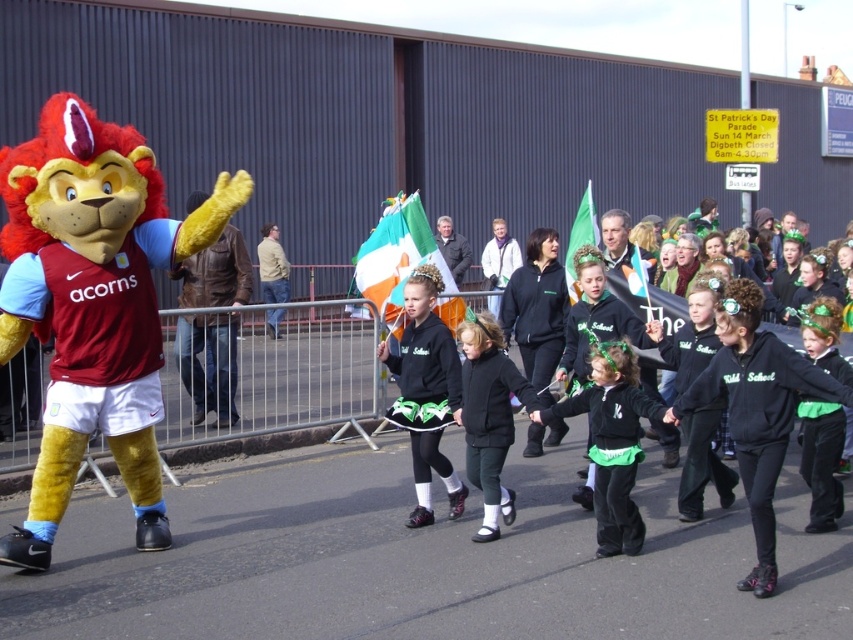
You are a photographer at the St. Patrick Day parade. You want to take a photo of the mascot on the left and the black matte skirt at center. Where should you position yourself to include both in the frame?

To capture both the mascot on the left and the black matte skirt at center in your photo, position yourself centrally so that both elements are within the frame. The mascot is on the left side of the frame, and the black matte skirt at center is located at point coordinates (426, 392), which is near the middle of the image. Adjust your camera angle to ensure both are visible.

You are a photographer trying to capture the St Patrick s Day parade. You notice the velvet plush lion at left and the green fabric flag at center. Which object should you focus on to ensure it fits entirely within your camera frame if your lens can only accommodate objects up to the height of the shorter one?

The velvet plush lion at left has a lesser height compared to the green fabric flag at center, so you should focus on the velvet plush lion at left to ensure it fits within the camera frame since it is shorter.